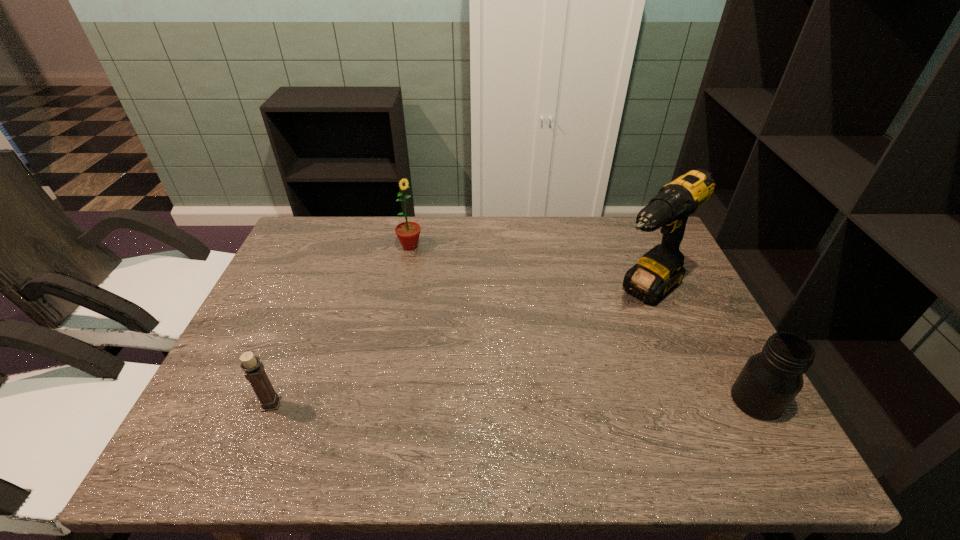
This screenshot has width=960, height=540. What are the coordinates of `free space located 0.130m at the tip of the drill` in the screenshot? It's located at (593, 338).

Find the location of a particular element. The width and height of the screenshot is (960, 540). free space located 0.220m on the face of the sunflower is located at coordinates (455, 292).

Find the location of a particular element. The width and height of the screenshot is (960, 540). vacant space located 0.220m on the face of the sunflower is located at coordinates (455, 292).

Where is `vacant space situated on the face of the sunflower`? Image resolution: width=960 pixels, height=540 pixels. vacant space situated on the face of the sunflower is located at coordinates (444, 281).

Where is `object located in the far edge section of the desktop`? The image size is (960, 540). object located in the far edge section of the desktop is located at coordinates (408, 233).

The width and height of the screenshot is (960, 540). I want to click on candle holder positioned at the near edge, so click(x=254, y=370).

Identify the location of jar that is at the near edge. This screenshot has height=540, width=960. (770, 380).

Find the location of `object at the left edge`. object at the left edge is located at coordinates (254, 370).

I want to click on jar located in the right edge section of the desktop, so click(x=770, y=380).

I want to click on drill situated at the right edge, so click(x=659, y=271).